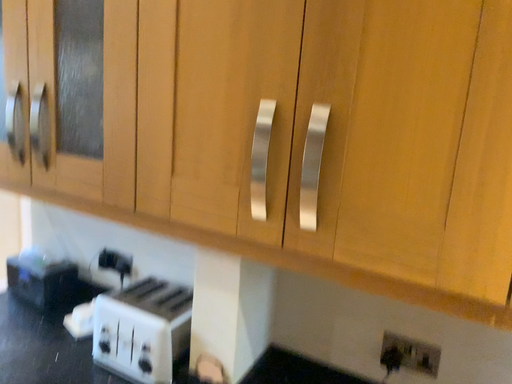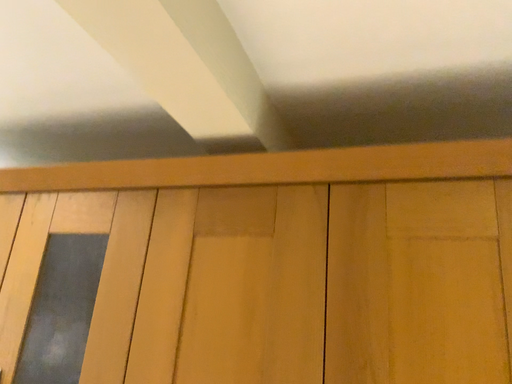
Question: Which way did the camera rotate in the video?

Choices:
 (A) rotated downward
 (B) rotated upward

Answer: (B)